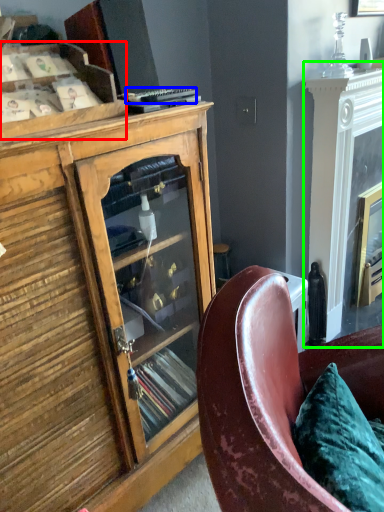
Question: Considering the real-world distances, which object is closest to shelf (highlighted by a red box)? remote control (highlighted by a blue box) or fireplace (highlighted by a green box).

Choices:
 (A) remote control
 (B) fireplace

Answer: (A)